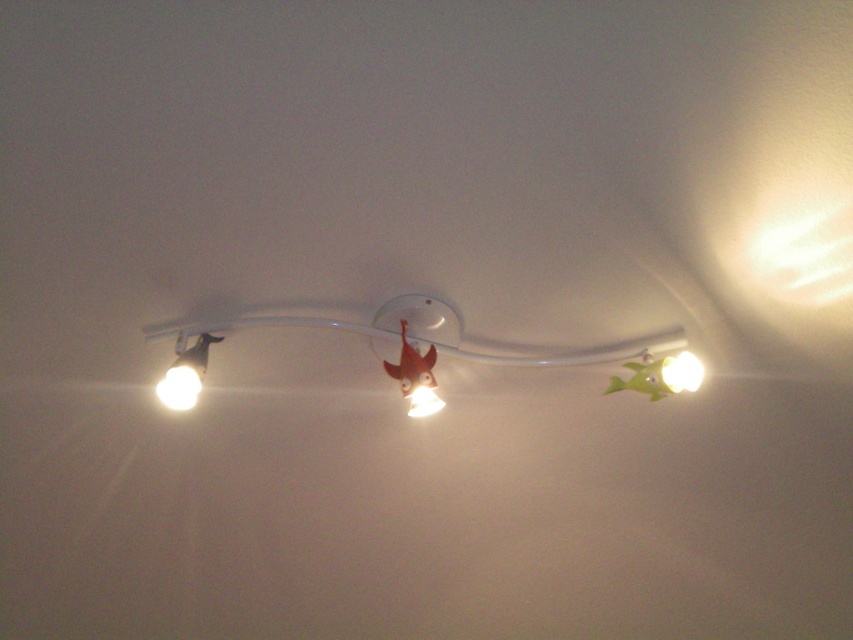
Who is taller, matte white spotlight at left or white glossy light bulb at left?

matte white spotlight at left

How far apart are matte white spotlight at left and white glossy light bulb at left?

They are 1.16 centimeters apart.

Which is behind, point (207, 346) or point (183, 371)?

Positioned behind is point (207, 346).

I want to click on matte white spotlight at left, so click(184, 374).

Is matte white spotlight at left to the right of white glossy light at upper right from the viewer's perspective?

Incorrect, matte white spotlight at left is not on the right side of white glossy light at upper right.

Does point (189, 387) lie behind point (665, 385)?

No, (189, 387) is in front of (665, 385).

Which is behind, point (195, 356) or point (683, 368)?

The point (683, 368) is behind.

The width and height of the screenshot is (853, 640). I want to click on matte white spotlight at left, so click(184, 374).

Between point (171, 390) and point (422, 396), which one is positioned behind?

The point (422, 396) is behind.

Describe the element at coordinates (180, 385) in the screenshot. I see `white glossy light bulb at left` at that location.

This screenshot has height=640, width=853. I want to click on white glossy light bulb at left, so click(180, 385).